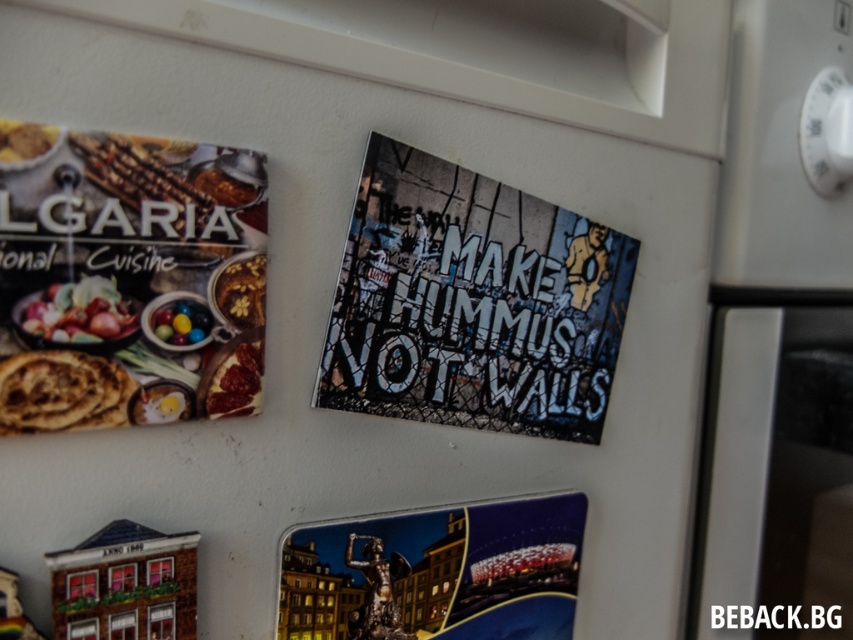
Question: Observing the image, what is the correct spatial positioning of brown crumbly bread at left in reference to shiny metallic bowl at upper left?

Choices:
 (A) left
 (B) right

Answer: (A)

Question: Can you confirm if metallic poster at center is positioned to the left of brown crumbly bread at left?

Choices:
 (A) no
 (B) yes

Answer: (A)

Question: Which object is closer to the camera taking this photo?

Choices:
 (A) shiny multicolored candies at center
 (B) flaky pastry at upper left
 (C) shiny metallic bowl at upper left
 (D) metallic statue at lower center

Answer: (C)

Question: Estimate the real-world distances between objects in this image. Which object is farther from the matte brown bread at lower left?

Choices:
 (A) shiny multicolored candies at center
 (B) metallic poster at center
 (C) brown crumbly bread at left
 (D) matte brown bread at upper left

Answer: (B)

Question: Is metallic poster at center positioned behind brown matte hummus at upper left?

Choices:
 (A) no
 (B) yes

Answer: (B)

Question: Which point is closer to the camera taking this photo?

Choices:
 (A) (74, 387)
 (B) (195, 340)
 (C) (397, 588)

Answer: (A)